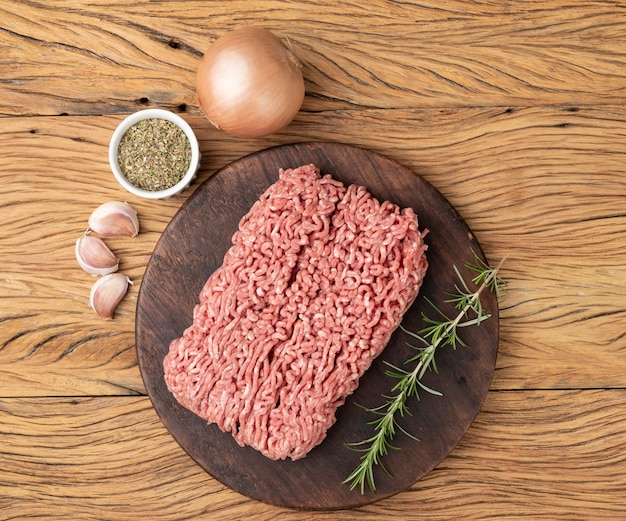
Identify the location of cutting board. This screenshot has height=521, width=626. (451, 406).